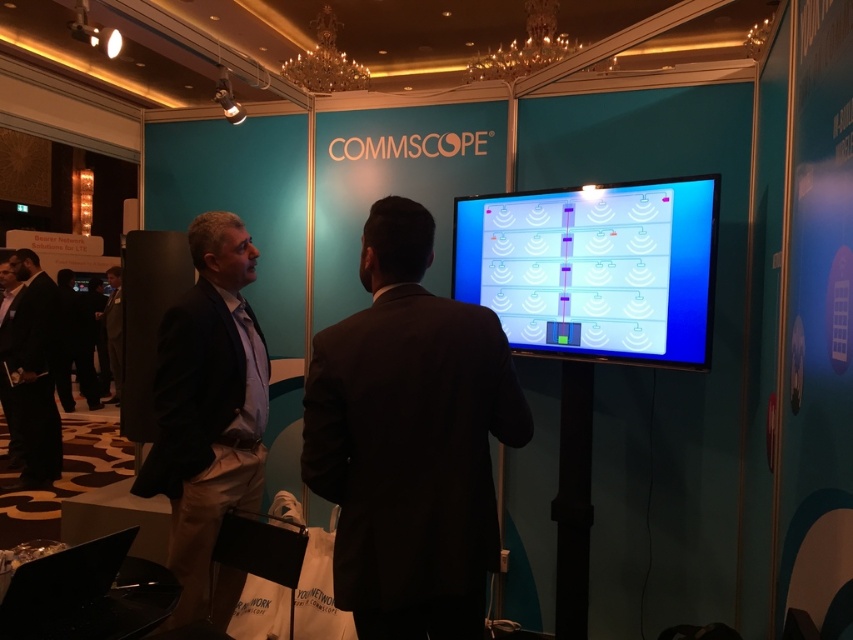
Between point (93, 349) and point (115, 344), which one is positioned in front?

Positioned in front is point (115, 344).

The image size is (853, 640). What do you see at coordinates (74, 344) in the screenshot?
I see `black fabric pants at lower left` at bounding box center [74, 344].

Between point (62, 284) and point (117, 330), which one is positioned behind?

The point (62, 284) is behind.

This screenshot has width=853, height=640. In order to click on black fabric pants at lower left in this screenshot , I will do `click(74, 344)`.

Is point (193, 557) closer to camera compared to point (113, 308)?

Yes.

Can you confirm if dark brown suit at left is wider than dark suit at center?

Incorrect, dark brown suit at left's width does not surpass dark suit at center's.

Image resolution: width=853 pixels, height=640 pixels. Find the location of `dark brown suit at left`. dark brown suit at left is located at coordinates (207, 416).

I want to click on dark brown suit at left, so click(207, 416).

Who is more distant from viewer, (590, 234) or (90, 310)?

Point (90, 310)

Where is `blue glossy screen at center`? Image resolution: width=853 pixels, height=640 pixels. blue glossy screen at center is located at coordinates (595, 268).